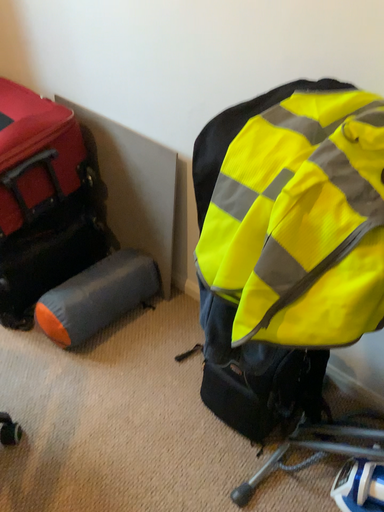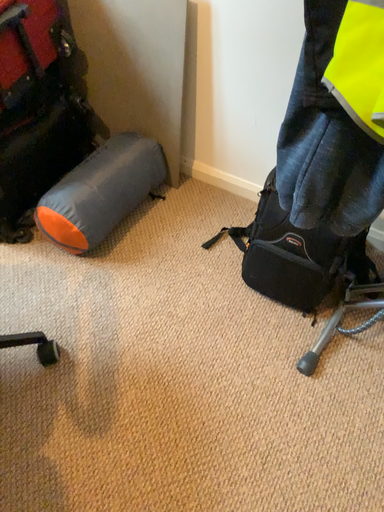
Question: How did the camera likely rotate when shooting the video?

Choices:
 (A) rotated right
 (B) rotated left

Answer: (A)